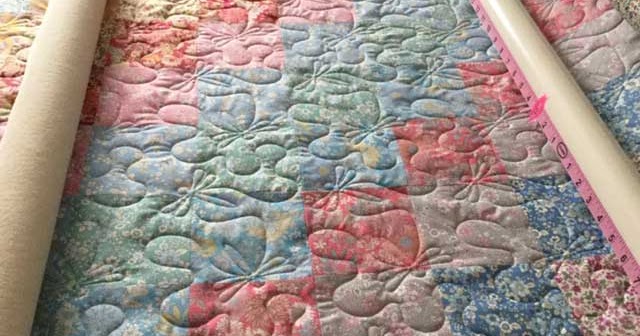
Identify the location of cream colored cylinders on the quilt. The image size is (640, 336). (44, 142), (556, 93).